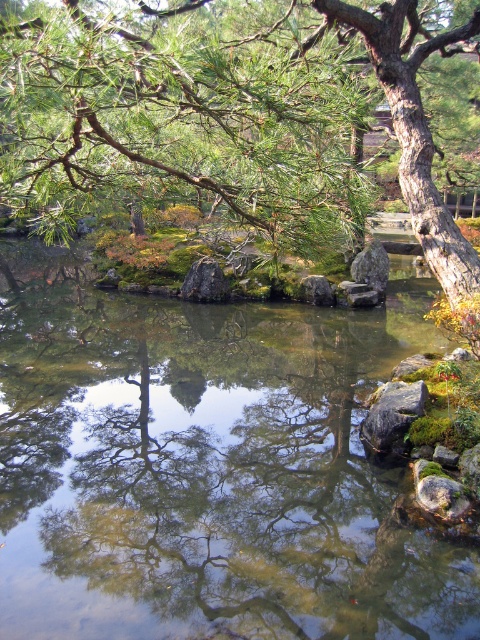
Question: From the image, what is the correct spatial relationship of green mossy rock at center in relation to gray rough stone at center?

Choices:
 (A) above
 (B) below

Answer: (A)

Question: Is clear water at center further to camera compared to gray rough stone at center?

Choices:
 (A) yes
 (B) no

Answer: (B)

Question: Can you confirm if clear water at center is thinner than green mossy rock at center?

Choices:
 (A) yes
 (B) no

Answer: (B)

Question: Which of the following is the farthest from the observer?

Choices:
 (A) dark gray rock at center-right
 (B) green needle-like branches at upper center

Answer: (A)

Question: Which point is closer to the camera?

Choices:
 (A) (379, 264)
 (B) (398, 422)
 (C) (194, 260)

Answer: (B)

Question: Which object is the farthest from the clear water at center?

Choices:
 (A) dark gray rock at center-right
 (B) green needle-like branches at upper center
 (C) gray rough stone at center
 (D) gray rock at center

Answer: (B)